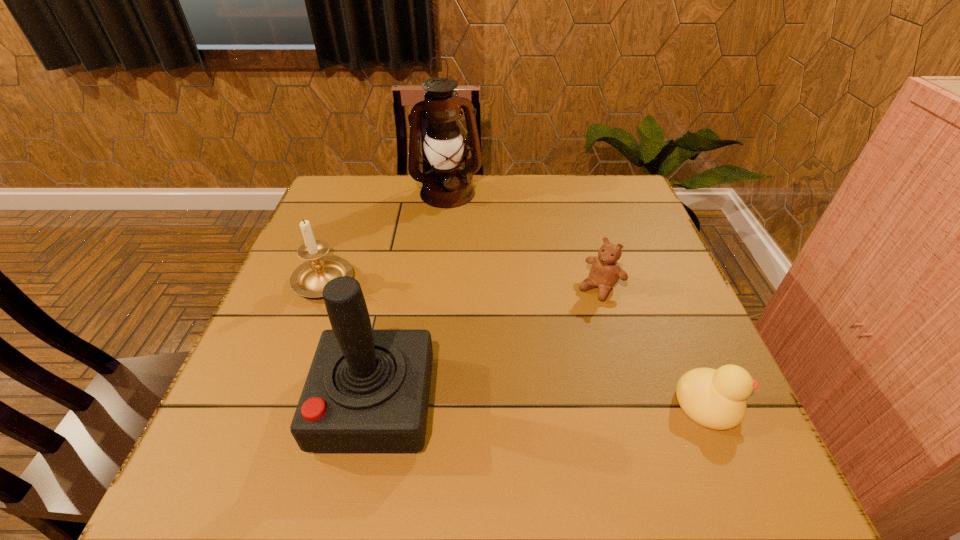
Find the location of a particular element. object that is the fourth closest to the farthest object is located at coordinates (715, 399).

Identify the location of vacant position in the image that satisfies the following two spatial constraints: 1. on the front side of the rightmost object; 2. on the face of the lantern. The height and width of the screenshot is (540, 960). (426, 403).

Where is `vacant space that satisfies the following two spatial constraints: 1. on the front side of the third tallest object; 2. on the base of the joystick`? This screenshot has height=540, width=960. vacant space that satisfies the following two spatial constraints: 1. on the front side of the third tallest object; 2. on the base of the joystick is located at coordinates (280, 403).

Locate an element on the screen. vacant space that satisfies the following two spatial constraints: 1. on the front side of the fourth tallest object; 2. on the right side of the tallest object is located at coordinates (438, 287).

This screenshot has height=540, width=960. What are the coordinates of `free space in the image that satisfies the following two spatial constraints: 1. on the back side of the candle holder; 2. on the left side of the farthest object` in the screenshot? It's located at (358, 193).

The image size is (960, 540). I want to click on free space in the image that satisfies the following two spatial constraints: 1. on the front side of the duckling; 2. on the face of the tallest object, so click(426, 403).